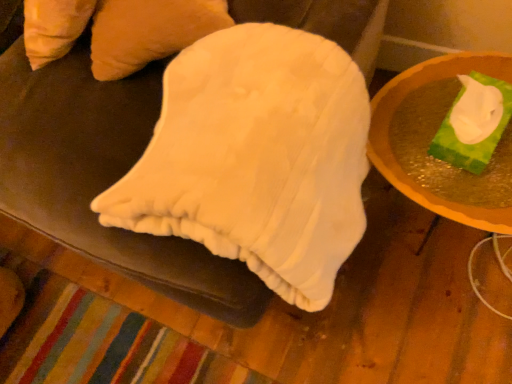
The image size is (512, 384). In order to click on vacant space to the left of green matte tissue box at right in this screenshot , I will do `click(399, 145)`.